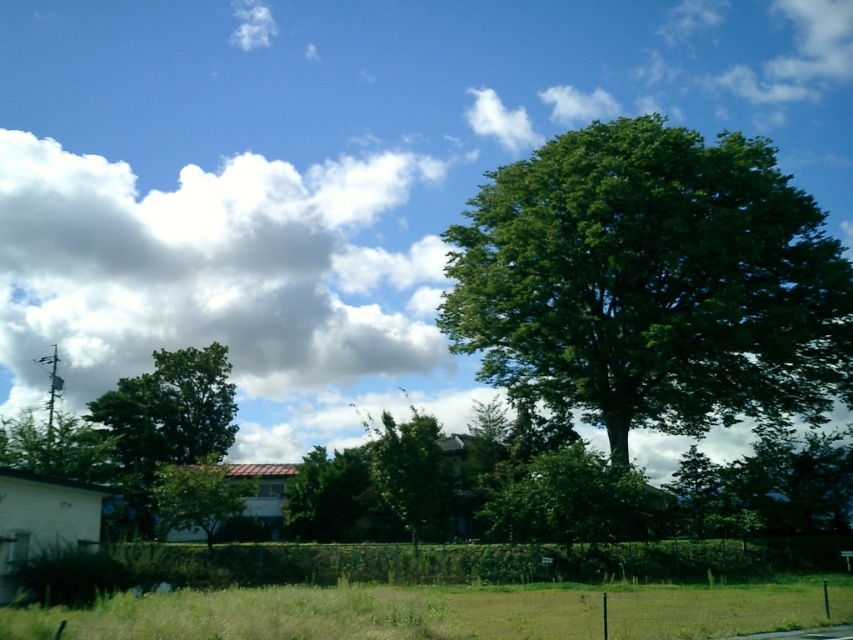
Does green grass at lower center have a lesser width compared to green leafy tree at lower left?

No.

Can you confirm if green grass at lower center is wider than green leafy tree at lower left?

Yes.

Measure the distance between green grass at lower center and camera.

green grass at lower center and camera are 10.32 meters apart from each other.

Where is `green grass at lower center`? The image size is (853, 640). green grass at lower center is located at coordinates (321, 614).

Between point (555, 221) and point (527, 595), which one is positioned behind?

The point (555, 221) is behind.

The image size is (853, 640). What are the coordinates of `green leafy tree at right` in the screenshot? It's located at (653, 282).

What do you see at coordinates (653, 282) in the screenshot? I see `green leafy tree at right` at bounding box center [653, 282].

At what (x,y) coordinates should I click in order to perform the action: click on green leafy tree at right. Please return your answer as a coordinate pair (x, y). The image size is (853, 640). Looking at the image, I should click on (653, 282).

Between white fluffy cloud at upper left and green leafy tree at right, which one has more height?

white fluffy cloud at upper left is taller.

Can you confirm if white fluffy cloud at upper left is shorter than green leafy tree at right?

No.

The height and width of the screenshot is (640, 853). What do you see at coordinates (337, 173) in the screenshot?
I see `white fluffy cloud at upper left` at bounding box center [337, 173].

Where is `white fluffy cloud at upper left`? Image resolution: width=853 pixels, height=640 pixels. white fluffy cloud at upper left is located at coordinates click(x=337, y=173).